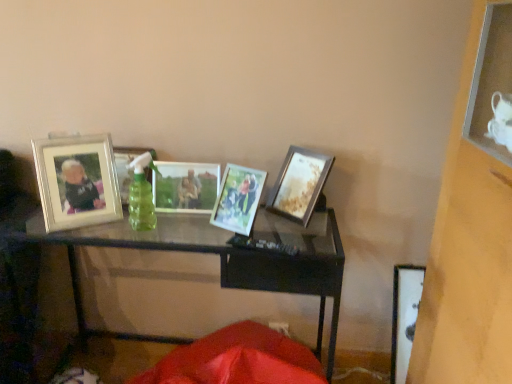
This screenshot has height=384, width=512. Describe the element at coordinates (77, 181) in the screenshot. I see `silver metallic photo frame at left, arranged as the first picture frame when viewed from the left` at that location.

What do you see at coordinates (224, 256) in the screenshot? I see `black glass table at center` at bounding box center [224, 256].

Locate an element on the screen. The image size is (512, 384). black glass table at center is located at coordinates (224, 256).

What do you see at coordinates (238, 199) in the screenshot? I see `metallic silver photo frame at center, the second picture frame positioned from the right` at bounding box center [238, 199].

Find the location of a particular element. The width and height of the screenshot is (512, 384). silver metallic photo frame at left, arranged as the first picture frame when viewed from the left is located at coordinates (77, 181).

Which object is positioned more to the left, metallic silver photo frame at center, which is the 3th picture frame from left to right, or wooden photo frame at center, the fifth picture frame positioned from the left?

Positioned to the left is metallic silver photo frame at center, which is the 3th picture frame from left to right.

Is there a large distance between metallic silver photo frame at center, positioned as the 3th picture frame in right-to-left order, and wooden photo frame at center, the fifth picture frame positioned from the left?

Actually, metallic silver photo frame at center, positioned as the 3th picture frame in right-to-left order, and wooden photo frame at center, the fifth picture frame positioned from the left, are a little close together.

The height and width of the screenshot is (384, 512). In order to click on the 1st picture frame in front of the metallic silver photo frame at center, positioned as the 3th picture frame in right-to-left order, counting from the anchor's position in this screenshot , I will do (298, 184).

Is silver metallic photo frame at left, arranged as the fifth picture frame when viewed from the right, surrounding matte glass picture frame at left, the fourth picture frame from the right?

No.

Looking at this image, does silver metallic photo frame at left, arranged as the fifth picture frame when viewed from the right, have a larger size compared to matte glass picture frame at left, placed as the 2th picture frame when sorted from left to right?

Yes, silver metallic photo frame at left, arranged as the fifth picture frame when viewed from the right, is bigger than matte glass picture frame at left, placed as the 2th picture frame when sorted from left to right.

Which is behind, silver metallic photo frame at left, arranged as the fifth picture frame when viewed from the right, or matte glass picture frame at left, the fourth picture frame from the right?

matte glass picture frame at left, the fourth picture frame from the right.

From the image's perspective, who appears lower, silver metallic photo frame at left, arranged as the fifth picture frame when viewed from the right, or matte glass picture frame at left, placed as the 2th picture frame when sorted from left to right?

From the image's view, silver metallic photo frame at left, arranged as the fifth picture frame when viewed from the right, is below.

Is matte glass picture frame at left, placed as the 2th picture frame when sorted from left to right, oriented towards black glass table at center?

No, matte glass picture frame at left, placed as the 2th picture frame when sorted from left to right, is not turned towards black glass table at center.

Would you say matte glass picture frame at left, placed as the 2th picture frame when sorted from left to right, is inside or outside black glass table at center?

matte glass picture frame at left, placed as the 2th picture frame when sorted from left to right, is spatially situated outside black glass table at center.

What's the angular difference between matte glass picture frame at left, the fourth picture frame from the right, and black glass table at center's facing directions?

There is a 4.07-degree angle between the facing directions of matte glass picture frame at left, the fourth picture frame from the right, and black glass table at center.

Is black glass table at center bigger than metallic silver photo frame at center, which is the fourth picture frame from left to right?

Yes.

Locate an element on the screen. table that appears in front of the metallic silver photo frame at center, the second picture frame positioned from the right is located at coordinates (224, 256).

Is metallic silver photo frame at center, the second picture frame positioned from the right, surrounded by black glass table at center?

No, metallic silver photo frame at center, the second picture frame positioned from the right, is located outside of black glass table at center.

In the image, is silver metallic photo frame at left, arranged as the fifth picture frame when viewed from the right, on the left side or the right side of wooden photo frame at center, the 1th picture frame when ordered from right to left?

Based on their positions, silver metallic photo frame at left, arranged as the fifth picture frame when viewed from the right, is located to the left of wooden photo frame at center, the 1th picture frame when ordered from right to left.

Considering the sizes of objects silver metallic photo frame at left, arranged as the first picture frame when viewed from the left, and wooden photo frame at center, the fifth picture frame positioned from the left, in the image provided, who is shorter, silver metallic photo frame at left, arranged as the first picture frame when viewed from the left, or wooden photo frame at center, the fifth picture frame positioned from the left,?

silver metallic photo frame at left, arranged as the first picture frame when viewed from the left, is shorter.

Which of these two, silver metallic photo frame at left, arranged as the first picture frame when viewed from the left, or wooden photo frame at center, the fifth picture frame positioned from the left, is wider?

Wider between the two is silver metallic photo frame at left, arranged as the first picture frame when viewed from the left.

Would you say silver metallic photo frame at left, arranged as the fifth picture frame when viewed from the right, contains wooden photo frame at center, the fifth picture frame positioned from the left?

No, silver metallic photo frame at left, arranged as the fifth picture frame when viewed from the right, does not contain wooden photo frame at center, the fifth picture frame positioned from the left.

Looking at this image, does black glass table at center have a lesser height compared to wooden photo frame at center, the fifth picture frame positioned from the left?

No.

Considering the sizes of objects black glass table at center and wooden photo frame at center, the 1th picture frame when ordered from right to left, in the image provided, who is smaller, black glass table at center or wooden photo frame at center, the 1th picture frame when ordered from right to left,?

Smaller between the two is wooden photo frame at center, the 1th picture frame when ordered from right to left.

The height and width of the screenshot is (384, 512). In the image, there is a wooden photo frame at center, the fifth picture frame positioned from the left. In order to click on table below it (from a real-world perspective) in this screenshot , I will do `click(224, 256)`.

Looking at this image, is black glass table at center thinner than wooden photo frame at center, the 1th picture frame when ordered from right to left?

No, black glass table at center is not thinner than wooden photo frame at center, the 1th picture frame when ordered from right to left.

Which object is positioned more to the right, metallic silver photo frame at center, the second picture frame positioned from the right, or silver metallic photo frame at left, arranged as the first picture frame when viewed from the left?

Positioned to the right is metallic silver photo frame at center, the second picture frame positioned from the right.

From the picture: Is metallic silver photo frame at center, which is the fourth picture frame from left to right, wider than silver metallic photo frame at left, arranged as the first picture frame when viewed from the left?

→ In fact, metallic silver photo frame at center, which is the fourth picture frame from left to right, might be narrower than silver metallic photo frame at left, arranged as the first picture frame when viewed from the left.

From a real-world perspective, who is located lower, metallic silver photo frame at center, the second picture frame positioned from the right, or silver metallic photo frame at left, arranged as the fifth picture frame when viewed from the right?

metallic silver photo frame at center, the second picture frame positioned from the right.

Measure the distance between metallic silver photo frame at center, the second picture frame positioned from the right, and silver metallic photo frame at left, arranged as the first picture frame when viewed from the left.

A distance of 43.73 centimeters exists between metallic silver photo frame at center, the second picture frame positioned from the right, and silver metallic photo frame at left, arranged as the first picture frame when viewed from the left.

This screenshot has width=512, height=384. I want to click on the 1st picture frame behind when counting from the wooden photo frame at center, the fifth picture frame positioned from the left, so click(x=185, y=186).

At what (x,y) coordinates should I click in order to perform the action: click on the 1st picture frame positioned below the matte glass picture frame at left, placed as the 2th picture frame when sorted from left to right (from the image's perspective). Please return your answer as a coordinate pair (x, y). The height and width of the screenshot is (384, 512). Looking at the image, I should click on (77, 181).

Considering their positions, is black glass table at center positioned further to metallic silver photo frame at center, the second picture frame positioned from the right, than wooden photo frame at center, the fifth picture frame positioned from the left?

black glass table at center.

Looking at the image, which one is located closer to silver metallic photo frame at left, arranged as the fifth picture frame when viewed from the right, wooden photo frame at center, the fifth picture frame positioned from the left, or black glass table at center?

Among the two, black glass table at center is located nearer to silver metallic photo frame at left, arranged as the fifth picture frame when viewed from the right.

Considering their positions, is matte glass picture frame at left, the fourth picture frame from the right, positioned closer to metallic silver photo frame at center, positioned as the 3th picture frame in right-to-left order, than wooden photo frame at center, the fifth picture frame positioned from the left?

matte glass picture frame at left, the fourth picture frame from the right, lies closer to metallic silver photo frame at center, positioned as the 3th picture frame in right-to-left order, than the other object.

Which object lies further to the anchor point wooden photo frame at center, the 1th picture frame when ordered from right to left, black glass table at center or metallic silver photo frame at center, positioned as the 3th picture frame in right-to-left order?

Answer: Among the two, black glass table at center is located further to wooden photo frame at center, the 1th picture frame when ordered from right to left.

When comparing their distances from wooden photo frame at center, the fifth picture frame positioned from the left, does metallic silver photo frame at center, the second picture frame positioned from the right, or black glass table at center seem closer?

Among the two, metallic silver photo frame at center, the second picture frame positioned from the right, is located nearer to wooden photo frame at center, the fifth picture frame positioned from the left.

From the image, which object appears to be nearer to matte glass picture frame at left, the fourth picture frame from the right, wooden photo frame at center, the 1th picture frame when ordered from right to left, or black glass table at center?

black glass table at center.

Looking at this image, considering their positions, is wooden photo frame at center, the fifth picture frame positioned from the left, positioned further to black glass table at center than silver metallic photo frame at left, arranged as the fifth picture frame when viewed from the right?

wooden photo frame at center, the fifth picture frame positioned from the left.

Which object lies nearer to the anchor point metallic silver photo frame at center, which is the fourth picture frame from left to right, matte glass picture frame at left, placed as the 2th picture frame when sorted from left to right, or silver metallic photo frame at left, arranged as the first picture frame when viewed from the left?

Among the two, matte glass picture frame at left, placed as the 2th picture frame when sorted from left to right, is located nearer to metallic silver photo frame at center, which is the fourth picture frame from left to right.

Where is `picture frame located between silver metallic photo frame at left, arranged as the fifth picture frame when viewed from the right, and metallic silver photo frame at center, positioned as the 3th picture frame in right-to-left order, in the left-right direction`? picture frame located between silver metallic photo frame at left, arranged as the fifth picture frame when viewed from the right, and metallic silver photo frame at center, positioned as the 3th picture frame in right-to-left order, in the left-right direction is located at coordinates (127, 167).

Locate an element on the screen. Image resolution: width=512 pixels, height=384 pixels. picture frame between matte glass picture frame at left, placed as the 2th picture frame when sorted from left to right, and metallic silver photo frame at center, which is the fourth picture frame from left to right, from left to right is located at coordinates (185, 186).

Where is `table between silver metallic photo frame at left, arranged as the fifth picture frame when viewed from the right, and metallic silver photo frame at center, which is the fourth picture frame from left to right, from left to right`? The height and width of the screenshot is (384, 512). table between silver metallic photo frame at left, arranged as the fifth picture frame when viewed from the right, and metallic silver photo frame at center, which is the fourth picture frame from left to right, from left to right is located at coordinates (224, 256).

This screenshot has height=384, width=512. I want to click on picture frame situated between metallic silver photo frame at center, which is the 3th picture frame from left to right, and wooden photo frame at center, the 1th picture frame when ordered from right to left, from left to right, so click(238, 199).